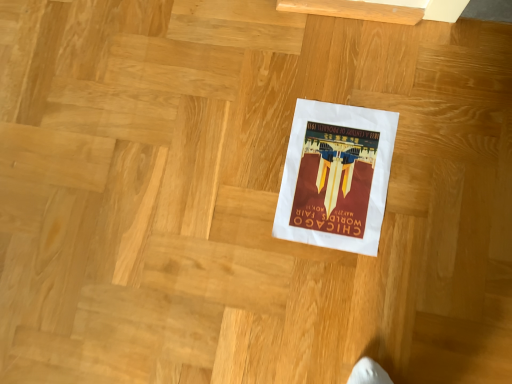
Question: From a real-world perspective, is white paper poster at center positioned under white paper at center based on gravity?

Choices:
 (A) no
 (B) yes

Answer: (B)

Question: From a real-world perspective, does white paper poster at center stand above white paper at center?

Choices:
 (A) yes
 (B) no

Answer: (B)

Question: From the image's perspective, is white paper poster at center above white paper at center?

Choices:
 (A) yes
 (B) no

Answer: (A)

Question: Can you see white paper poster at center touching white paper at center?

Choices:
 (A) no
 (B) yes

Answer: (A)

Question: Is white paper poster at center thinner than white paper at center?

Choices:
 (A) no
 (B) yes

Answer: (B)

Question: Is white paper poster at center further to the viewer compared to white paper at center?

Choices:
 (A) no
 (B) yes

Answer: (B)

Question: Is white paper at center located outside white paper poster at center?

Choices:
 (A) no
 (B) yes

Answer: (B)

Question: Considering the relative sizes of white paper at center and white paper poster at center in the image provided, is white paper at center bigger than white paper poster at center?

Choices:
 (A) no
 (B) yes

Answer: (B)

Question: From the image's perspective, would you say white paper at center is shown under white paper poster at center?

Choices:
 (A) no
 (B) yes

Answer: (B)

Question: From the image's perspective, would you say white paper at center is positioned over white paper poster at center?

Choices:
 (A) yes
 (B) no

Answer: (B)

Question: Is white paper at center looking in the opposite direction of white paper poster at center?

Choices:
 (A) yes
 (B) no

Answer: (A)

Question: Considering the relative sizes of white paper at center and white paper poster at center in the image provided, is white paper at center shorter than white paper poster at center?

Choices:
 (A) no
 (B) yes

Answer: (A)

Question: From a real-world perspective, relative to white paper poster at center, is white paper at center vertically above or below?

Choices:
 (A) below
 (B) above

Answer: (B)